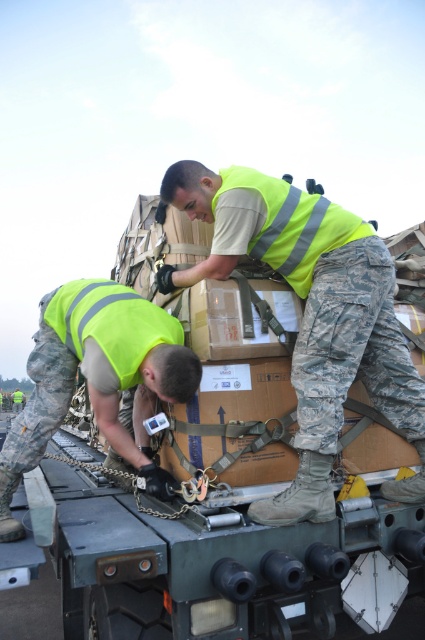
You are a drone operator trying to capture a closeup of the two points in the image. Which point, point (272, 188) or point (119, 435), is closer to the camera and thus would require less zoom to capture clearly?

Point (272, 188) is closer to the camera than point (119, 435), so it would require less zoom to capture clearly.

You are a safety inspector checking the cargo area of the green camouflage trailer truck at center. You notice the yellow reflective vest at center. Based on their positions, is the vest likely worn by one of the workers or placed on the cargo?

The green camouflage trailer truck at center is in front of the yellow reflective vest at center, which means the vest is positioned behind the truck. Since the vest is behind the truck, it is more likely placed on the cargo rather than worn by a worker.